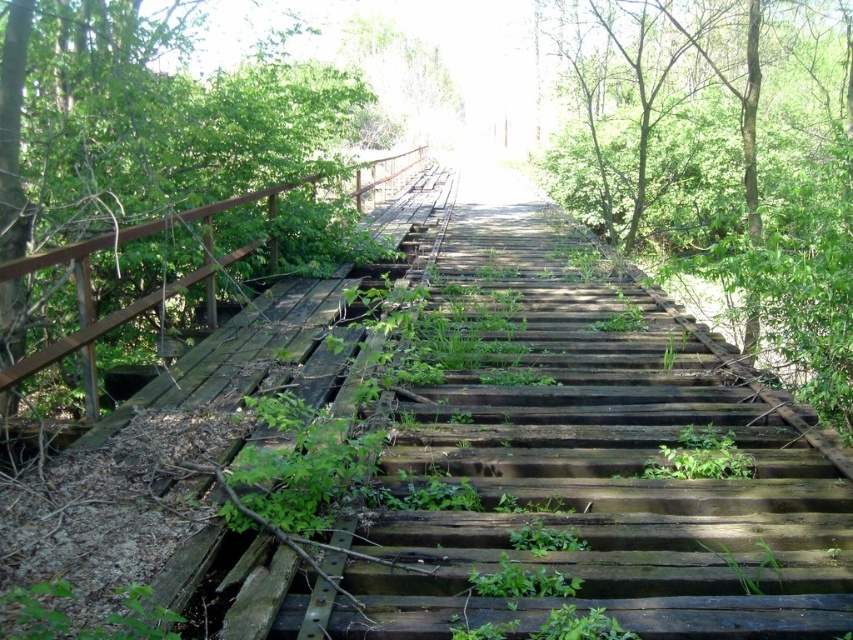
Is green leafy tree at center below green leafy tree at left?

Actually, green leafy tree at center is above green leafy tree at left.

Who is higher up, green leafy tree at center or green leafy tree at left?

green leafy tree at center

Locate an element on the screen. This screenshot has height=640, width=853. green leafy tree at center is located at coordinates (721, 164).

At what (x,y) coordinates should I click in order to perform the action: click on green leafy tree at center. Please return your answer as a coordinate pair (x, y). This screenshot has width=853, height=640. Looking at the image, I should click on (721, 164).

Does weathered wood stairs at center have a larger size compared to green leafy tree at left?

Yes.

Which is more to the right, weathered wood stairs at center or green leafy tree at left?

weathered wood stairs at center is more to the right.

Does point (416, 396) lie in front of point (259, 156)?

Yes.

I want to click on weathered wood stairs at center, so click(590, 461).

Can you confirm if weathered wood stairs at center is bigger than green leafy tree at center?

No.

Does weathered wood stairs at center appear on the right side of green leafy tree at center?

Incorrect, weathered wood stairs at center is not on the right side of green leafy tree at center.

What are the coordinates of `weathered wood stairs at center` in the screenshot? It's located at (590, 461).